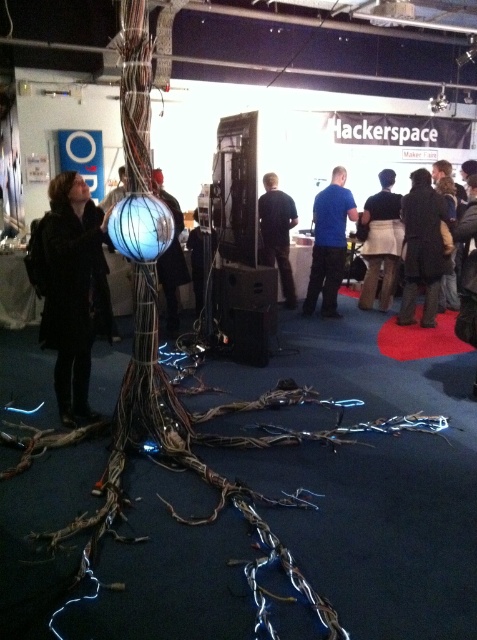
You are an attendee at the Hackerspace event and you see both the black fabric at center and the dark blue fabric jacket at center. Which one is taller?

The black fabric at center is taller than the dark blue fabric jacket at center.

You are organizing a tech event and need to place a new poster on the wall. The poster is the same size as the dark brown leather jacket at center. Will it fit in the space currently occupied by the shiny metallic sphere at center?

The dark brown leather jacket at center occupies less space than the shiny metallic sphere at center. Since the poster is the same size as the jacket, it will fit in the space occupied by the sphere because the sphere requires more space.